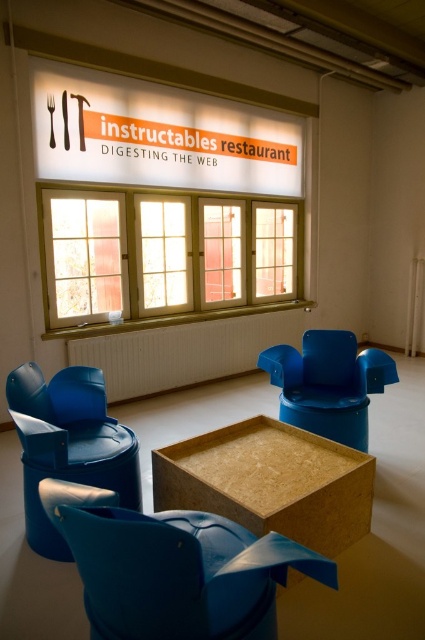
Question: Is wooden-framed window at center to the left of wooden frame window at center from the viewer's perspective?

Choices:
 (A) no
 (B) yes

Answer: (B)

Question: Considering the real-world distances, which object is farthest from the blue plastic chair at center?

Choices:
 (A) wooden-framed window at center
 (B) wooden table at center
 (C) wooden frame window at center
 (D) matte blue armchair at lower left

Answer: (C)

Question: Does blue plastic chair at center appear over wooden frame window at center?

Choices:
 (A) no
 (B) yes

Answer: (A)

Question: Is wooden-framed window at center positioned at the back of blue plastic swivel chair at lower left?

Choices:
 (A) no
 (B) yes

Answer: (B)

Question: Among these points, which one is nearest to the camera?

Choices:
 (A) (115, 259)
 (B) (362, 392)
 (C) (238, 536)

Answer: (C)

Question: Which object is positioned farthest from the wooden frame window at center?

Choices:
 (A) blue plastic chair at center
 (B) blue plastic swivel chair at lower left
 (C) matte blue armchair at lower left

Answer: (B)